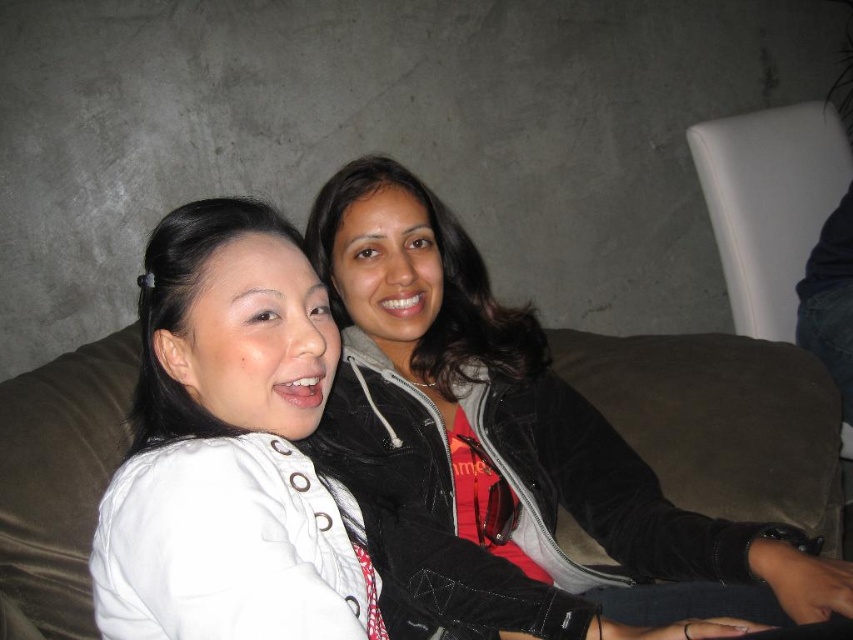
You are trying to decide which jacket to wear for a casual indoor gathering. Both the black velvet jacket at center and the white matte jacket at left are options. Considering their sizes, which one would you choose if you want a more spacious and comfortable fit?

The black velvet jacket at center has a larger width than the white matte jacket at left, so it would provide a more spacious and comfortable fit.

You are standing in front of the couch where two people are sitting. You need to place a small gift on the couch. The first point you choose is at coordinates point [331,262]. The second point is at coordinates point [231,589]. Which point is closer to the back of the couch?

Point [331,262] is behind point [231,589], so the first point is closer to the back of the couch.

You are standing in front of the couch where two people are sitting. You need to place a small gift box exactly at the position where the black velvet jacket at center is located. What are the coordinates where you should place the gift box?

The coordinates for placing the gift box should be at point (511, 456) where the black velvet jacket at center is located.